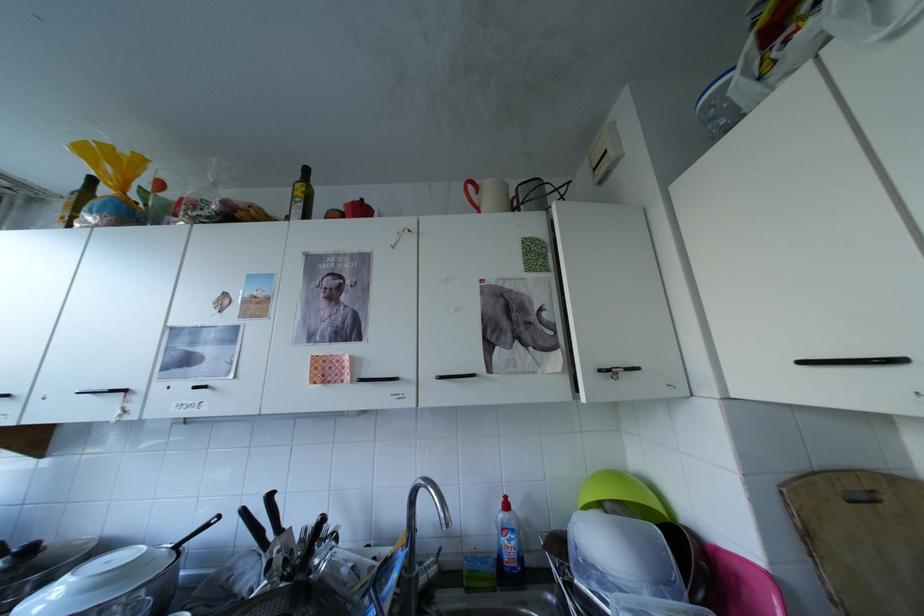
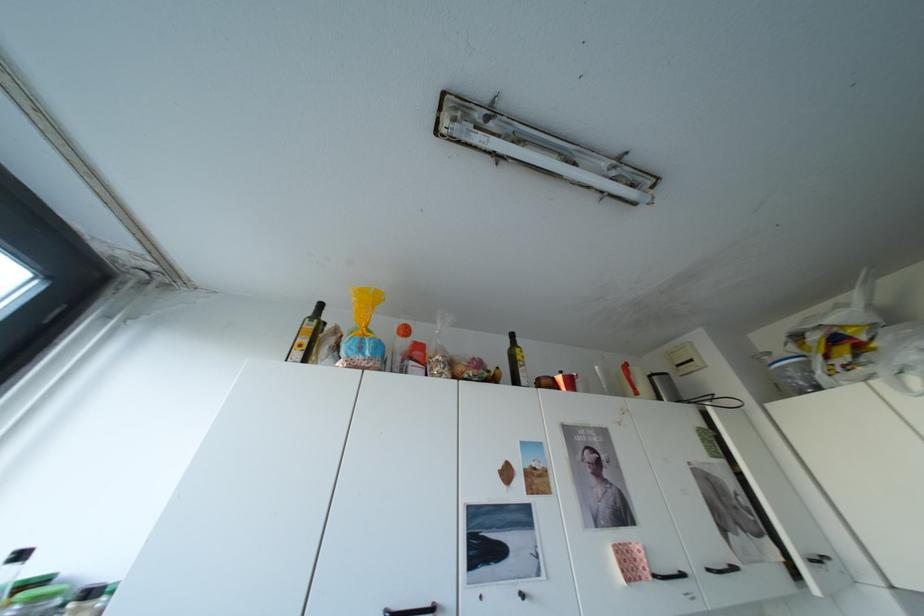
Locate, in the second image, the point that corresponds to point (337, 371) in the first image.

(642, 568)